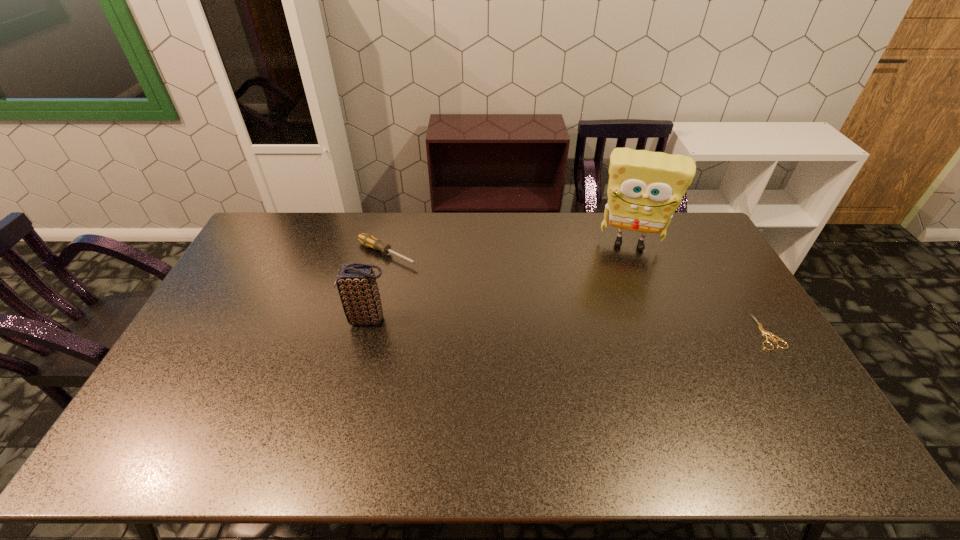
The height and width of the screenshot is (540, 960). In order to click on the second tallest object in this screenshot , I will do coord(356,282).

Locate an element on the screen. The width and height of the screenshot is (960, 540). the rightmost object is located at coordinates (764, 332).

Image resolution: width=960 pixels, height=540 pixels. I want to click on the shortest object, so click(764, 332).

Where is `screwdriver`? Image resolution: width=960 pixels, height=540 pixels. screwdriver is located at coordinates (368, 240).

You are a GUI agent. You are given a task and a screenshot of the screen. Output one action in this format:
    pyautogui.click(x=<x>, y=<y>)
    Task: Click on the sponge
    The image size is (960, 540).
    Given the screenshot: What is the action you would take?
    pyautogui.click(x=645, y=188)

Where is `the tallest object`? the tallest object is located at coordinates (645, 188).

You are a GUI agent. You are given a task and a screenshot of the screen. Output one action in this format:
    pyautogui.click(x=<x>, y=<y>)
    Task: Click on the free space located with the zip open on the clutch bag
    
    Given the screenshot: What is the action you would take?
    pyautogui.click(x=254, y=320)

Locate an element on the screen. Image resolution: width=960 pixels, height=540 pixels. vacant space located 0.090m with the zip open on the clutch bag is located at coordinates (317, 320).

Locate an element on the screen. Image resolution: width=960 pixels, height=540 pixels. blank space located with the zip open on the clutch bag is located at coordinates [x=287, y=320].

Where is `vacant point located on the back of the rightmost object`? vacant point located on the back of the rightmost object is located at coordinates (713, 246).